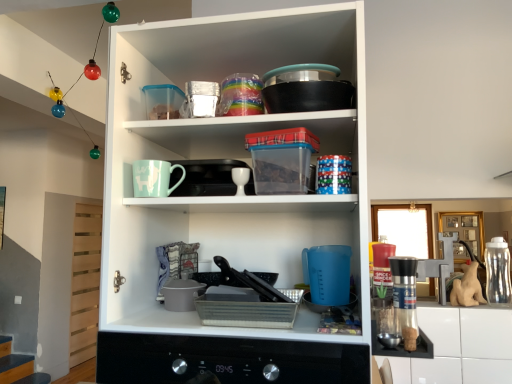
Describe the element at coordinates (227, 360) in the screenshot. I see `metallic black oven at center` at that location.

What do you see at coordinates (250, 282) in the screenshot? This screenshot has height=384, width=512. I see `metallic black tray at center, which is counted as the 2th appliance, starting from the bottom` at bounding box center [250, 282].

Describe the element at coordinates (202, 98) in the screenshot. I see `shiny metallic container at upper center, positioned as the second tableware in bottom-to-top order` at that location.

At what (x,y) coordinates should I click in order to perform the action: click on metallic silver tray at lower center, the 1th appliance positioned from the bottom. Please return your answer as a coordinate pair (x, y). This screenshot has height=384, width=512. Looking at the image, I should click on (246, 301).

Find the location of `white glossy egg cup at center, which is the first tableware from bottom to top`. white glossy egg cup at center, which is the first tableware from bottom to top is located at coordinates (240, 179).

Find the location of a particular element. metallic black oven at center is located at coordinates (227, 360).

Is matte white cupboard at center thinner than metallic silver tray at lower center, the 1th appliance positioned from the bottom?

No, matte white cupboard at center is not thinner than metallic silver tray at lower center, the 1th appliance positioned from the bottom.

Who is bigger, matte white cupboard at center or metallic silver tray at lower center, the 2th appliance positioned from the top?

matte white cupboard at center.

Does point (145, 67) come farther from viewer compared to point (252, 294)?

Yes.

Locate an element on the screen. The image size is (512, 384). cupboard on the left of metallic silver tray at lower center, the 1th appliance positioned from the bottom is located at coordinates (228, 200).

Which of these two, metallic black oven at center or shiny metallic container at upper center, the first tableware positioned from the left, is wider?

Wider between the two is metallic black oven at center.

Where is `the 1st tableware behind when counting from the metallic black oven at center`? the 1st tableware behind when counting from the metallic black oven at center is located at coordinates (202, 98).

Is metallic black oven at center smaller than shiny metallic container at upper center, the 1th tableware viewed from the top?

No, metallic black oven at center is not smaller than shiny metallic container at upper center, the 1th tableware viewed from the top.

Which of these two, transparent plastic bottle at right or matte ceramic mug at upper center, is smaller?

matte ceramic mug at upper center is smaller.

Would you say transparent plastic bottle at right is outside matte ceramic mug at upper center?

transparent plastic bottle at right lies outside matte ceramic mug at upper center's area.

From the image's perspective, is transparent plastic bottle at right below matte ceramic mug at upper center?

Indeed, from the image's perspective, transparent plastic bottle at right is shown beneath matte ceramic mug at upper center.

Based on their positions, is metallic black oven at center located to the left or right of matte ceramic mug at upper center?

Based on their positions, metallic black oven at center is located to the right of matte ceramic mug at upper center.

Locate an element on the screen. Image resolution: width=512 pixels, height=384 pixels. mug behind the metallic black oven at center is located at coordinates (154, 178).

Which is in front, point (273, 367) or point (143, 165)?

The point (273, 367) is closer to the camera.

In the scene shown: Would you consider metallic black oven at center to be distant from matte ceramic mug at upper center?

No, metallic black oven at center is not far from matte ceramic mug at upper center.

From a real-world perspective, is metallic black tray at center, which is counted as the 2th appliance, starting from the bottom, over matte white cupboard at center?

Incorrect, from a real-world perspective, metallic black tray at center, which is counted as the 2th appliance, starting from the bottom, is lower than matte white cupboard at center.

Which point is more distant from viewer, (221,272) or (189,321)?

The point (221,272) is farther from the camera.

Locate an element on the screen. appliance that is the 2nd object located behind the matte white cupboard at center is located at coordinates (250, 282).

Can you confirm if metallic black tray at center, which is counted as the 2th appliance, starting from the bottom, is thinner than matte white cupboard at center?

Indeed, metallic black tray at center, which is counted as the 2th appliance, starting from the bottom, has a lesser width compared to matte white cupboard at center.

Are metallic black oven at center and white glossy egg cup at center, placed as the 2th tableware when sorted from left to right, located far from each other?

No, metallic black oven at center is in close proximity to white glossy egg cup at center, placed as the 2th tableware when sorted from left to right.

In terms of height, does metallic black oven at center look taller or shorter compared to white glossy egg cup at center, the 2th tableware positioned from the top?

Considering their sizes, metallic black oven at center has more height than white glossy egg cup at center, the 2th tableware positioned from the top.

From a real-world perspective, which object rests below the other?

metallic black oven at center, from a real-world perspective.

Find the location of a particular element. tableware that is the 2nd one when counting backward from the metallic black oven at center is located at coordinates (240, 179).

How far apart are metallic silver tray at lower center, the 2th appliance positioned from the top, and metallic black oven at center?

metallic silver tray at lower center, the 2th appliance positioned from the top, and metallic black oven at center are 12.06 centimeters apart from each other.

Which is more to the right, metallic silver tray at lower center, the 2th appliance positioned from the top, or metallic black oven at center?

metallic black oven at center.

Is metallic silver tray at lower center, the 1th appliance positioned from the bottom, touching metallic black oven at center?

No, metallic silver tray at lower center, the 1th appliance positioned from the bottom, is not with metallic black oven at center.

Which point is more distant from viewer, [228,291] or [270,351]?

The point [228,291] is farther from the camera.

The image size is (512, 384). Identify the location of the 1st appliance behind the matte white cupboard at center. (246, 301).

In the image, there is a shiny metallic container at upper center, which is the 2th tableware from right to left. At what (x,y) coordinates should I click in order to perform the action: click on home appliance below it (from a real-world perspective). Please return your answer as a coordinate pair (x, y). Looking at the image, I should click on click(x=227, y=360).

When comparing their distances from transparent plastic bottle at right, does metallic black oven at center or shiny metallic container at upper center, the 1th tableware viewed from the top, seem closer?

metallic black oven at center.

Estimate the real-world distances between objects in this image. Which object is closer to metallic black oven at center, white glossy egg cup at center, which is the first tableware from bottom to top, or shiny metallic container at upper center, which is the 2th tableware from right to left?

Based on the image, white glossy egg cup at center, which is the first tableware from bottom to top, appears to be nearer to metallic black oven at center.

Based on their spatial positions, is transparent plastic bottle at right or matte ceramic mug at upper center closer to matte white cupboard at center?

The object closer to matte white cupboard at center is matte ceramic mug at upper center.

Which object lies further to the anchor point shiny metallic container at upper center, the 1th tableware viewed from the top, metallic black tray at center, which is counted as the 2th appliance, starting from the bottom, or transparent plastic bottle at right?

Among the two, transparent plastic bottle at right is located further to shiny metallic container at upper center, the 1th tableware viewed from the top.

Estimate the real-world distances between objects in this image. Which object is closer to matte white cupboard at center, shiny metallic container at upper center, the 1th tableware viewed from the top, or matte ceramic mug at upper center?

matte ceramic mug at upper center is closer to matte white cupboard at center.

When comparing their distances from transparent plastic bottle at right, does metallic black tray at center, which is counted as the 2th appliance, starting from the bottom, or matte white cupboard at center seem further?

Based on the image, matte white cupboard at center appears to be further to transparent plastic bottle at right.

Which object lies nearer to the anchor point white glossy egg cup at center, the 1th tableware viewed from the right, transparent plastic bottle at right or metallic black oven at center?

Based on the image, metallic black oven at center appears to be nearer to white glossy egg cup at center, the 1th tableware viewed from the right.

Which object lies nearer to the anchor point matte white cupboard at center, metallic black oven at center or matte ceramic mug at upper center?

matte ceramic mug at upper center is closer to matte white cupboard at center.

Locate an element on the screen. This screenshot has height=384, width=512. cupboard between white glossy egg cup at center, placed as the 2th tableware when sorted from left to right, and metallic silver tray at lower center, the 1th appliance positioned from the bottom, from top to bottom is located at coordinates (228, 200).

In order to click on tableware between shiny metallic container at upper center, the first tableware positioned from the left, and metallic black tray at center, which is counted as the 2th appliance, starting from the bottom, vertically in this screenshot , I will do `click(240, 179)`.

The height and width of the screenshot is (384, 512). What are the coordinates of `appliance between metallic black tray at center, which appears as the first appliance when viewed from the top, and metallic black oven at center in the up-down direction` in the screenshot? It's located at (246, 301).

Identify the location of home appliance between white glossy egg cup at center, placed as the 2th tableware when sorted from left to right, and transparent plastic bottle at right from left to right. (227, 360).